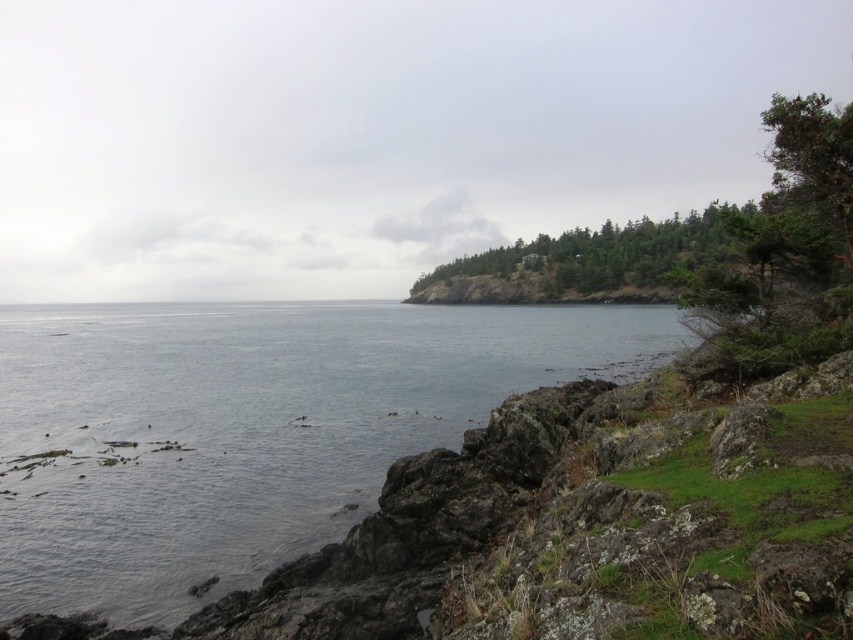
Question: Which object is the closest to the green leafy trees at upper right?

Choices:
 (A) clear water at lower left
 (B) green textured tree at upper right

Answer: (A)

Question: Observing the image, what is the correct spatial positioning of clear water at lower left in reference to green leafy trees at upper right?

Choices:
 (A) above
 (B) below

Answer: (B)

Question: Can you confirm if green textured tree at upper right is positioned below green leafy trees at upper right?

Choices:
 (A) yes
 (B) no

Answer: (A)

Question: Which point appears closest to the camera in this image?

Choices:
 (A) (840, 268)
 (B) (4, 612)
 (C) (531, 273)

Answer: (B)

Question: Considering the relative positions of green textured tree at upper right and green leafy trees at upper right in the image provided, where is green textured tree at upper right located with respect to green leafy trees at upper right?

Choices:
 (A) below
 (B) above

Answer: (A)

Question: Estimate the real-world distances between objects in this image. Which object is farther from the green leafy trees at upper right?

Choices:
 (A) green textured tree at upper right
 (B) clear water at lower left

Answer: (A)